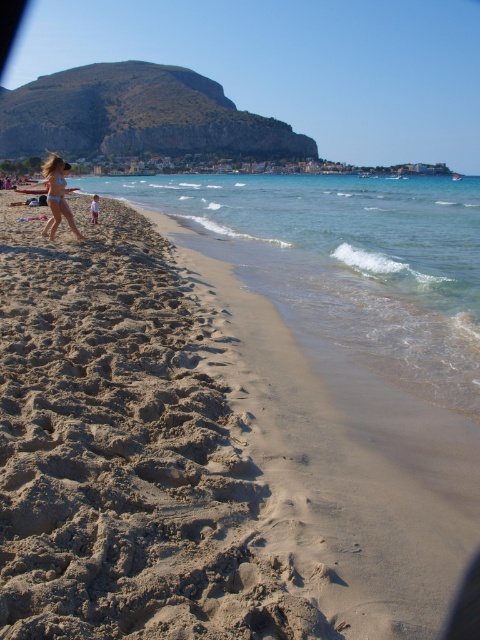
You are a swimmer planning to retrieve your matte bikini at left from the beach. You notice the clear blue water at lower left. Which object is closer to the shoreline?

The matte bikini at left is closer to the shoreline because the clear blue water at lower left is above it, meaning the water is further out towards the sea.

You are standing on the golden sand beach at left and want to walk to the clear blue water at lower left. Which direction should you move to reach the water?

You should move to the right because the golden sand beach at left is to the left of the clear blue water at lower left, so moving right from the beach will lead you towards the water.

You are standing on the beach and see two points marked in the image. The first point is at coordinate point(129, 385) and the second is at point(425, 244). Which point is closer to you?

Point(129, 385) is in front of point(425, 244), so it is closer to you.